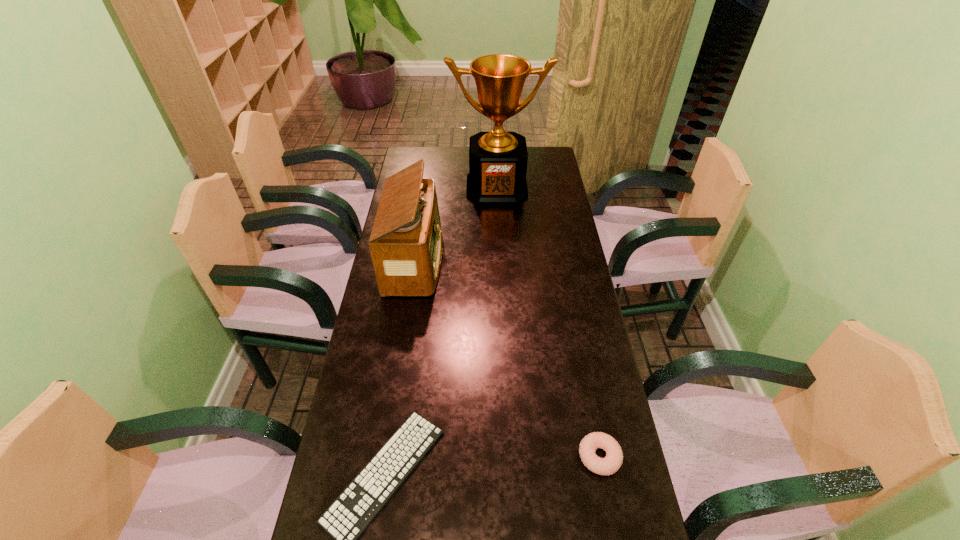
The image size is (960, 540). In order to click on trophy cup in this screenshot , I will do `click(498, 159)`.

The height and width of the screenshot is (540, 960). Identify the location of the tallest object. (498, 159).

The height and width of the screenshot is (540, 960). I want to click on the third shortest object, so click(405, 244).

Where is `the third nearest object`? This screenshot has height=540, width=960. the third nearest object is located at coordinates (405, 244).

Locate an element on the screen. This screenshot has height=540, width=960. doughnut is located at coordinates (612, 462).

This screenshot has height=540, width=960. I want to click on free space located 0.290m on the front of the trophy cup with the label, so click(500, 251).

Locate an element on the screen. This screenshot has height=540, width=960. free spot located on the front panel of the second tallest object is located at coordinates (535, 261).

Locate an element on the screen. free point located on the back of the third tallest object is located at coordinates (587, 392).

This screenshot has width=960, height=540. I want to click on object that is positioned at the far edge, so click(x=498, y=159).

This screenshot has height=540, width=960. Identify the location of object that is positioned at the left edge. (405, 244).